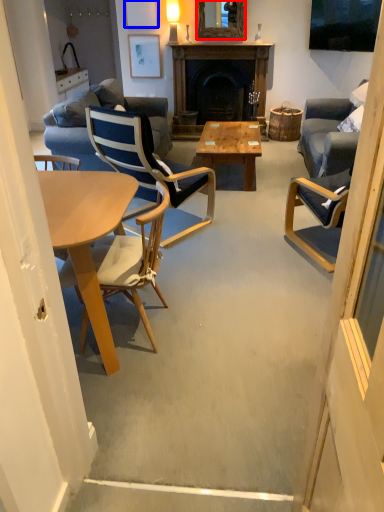
Question: Which object appears farthest to the camera in this image, mirror (highlighted by a red box) or picture frame (highlighted by a blue box)?

Choices:
 (A) mirror
 (B) picture frame

Answer: (B)